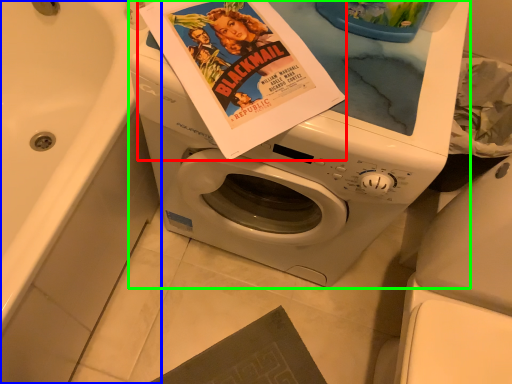
Question: Which is farther away from paperback book (highlighted by a red box)? bath (highlighted by a blue box) or washing machine (highlighted by a green box)?

Choices:
 (A) bath
 (B) washing machine

Answer: (A)